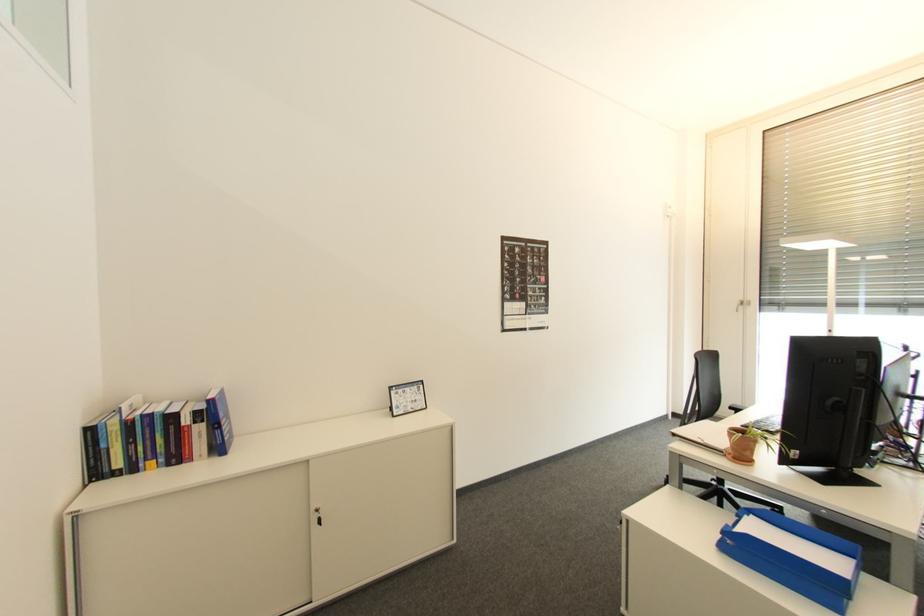
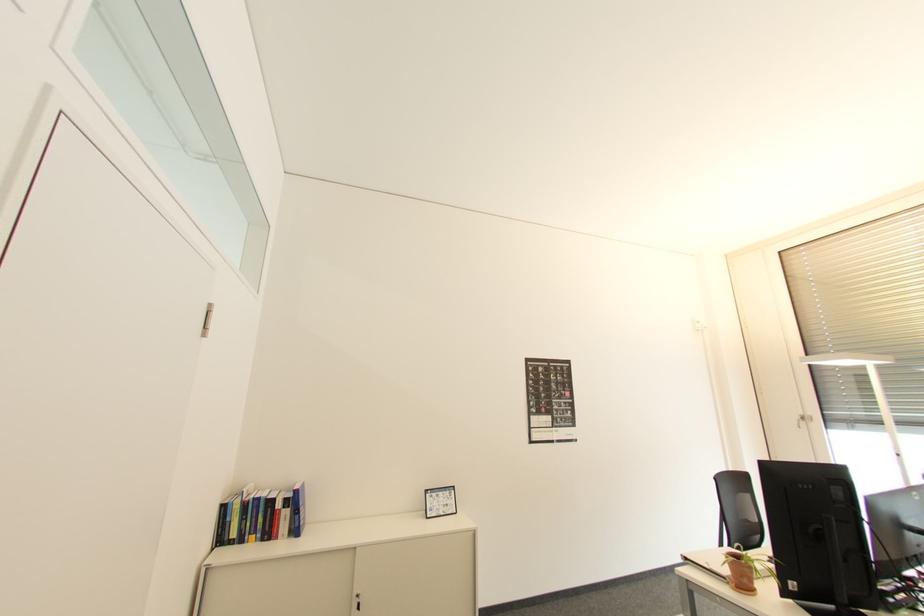
In a continuous first-person perspective shot, in which direction is the camera moving?

The movement direction of the cameraman is right, backward.